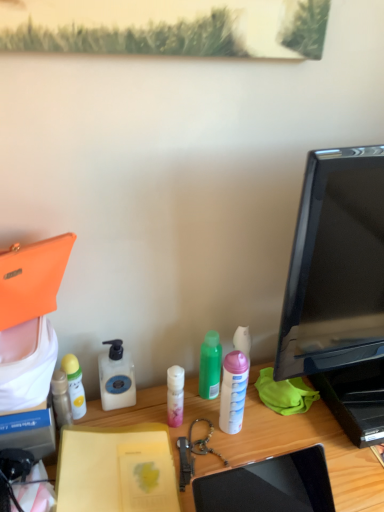
Question: Is yellow matte bottle at left, acting as the 4th bottle starting from the right, to the right of white matte spray can at center, the 1th bottle from the right, from the viewer's perspective?

Choices:
 (A) no
 (B) yes

Answer: (A)

Question: Is yellow matte bottle at left, arranged as the second bottle when viewed from the left, taller than white matte spray can at center, the 1th bottle from the right?

Choices:
 (A) yes
 (B) no

Answer: (B)

Question: Would you say white matte spray can at center, arranged as the 5th bottle when viewed from the left, is part of yellow matte bottle at left, arranged as the second bottle when viewed from the left,'s contents?

Choices:
 (A) yes
 (B) no

Answer: (B)

Question: From a real-world perspective, is yellow matte bottle at left, arranged as the second bottle when viewed from the left, physically above white matte spray can at center, the 1th bottle from the right?

Choices:
 (A) yes
 (B) no

Answer: (B)

Question: Is yellow matte bottle at left, arranged as the second bottle when viewed from the left, oriented away from white matte spray can at center, the 1th bottle from the right?

Choices:
 (A) no
 (B) yes

Answer: (A)

Question: Is yellow matte bottle at left, acting as the 4th bottle starting from the right, positioned far away from white matte spray can at center, the 1th bottle from the right?

Choices:
 (A) no
 (B) yes

Answer: (A)

Question: Considering the relative positions of white matte spray can at center, arranged as the 5th bottle when viewed from the left, and wooden desk at center in the image provided, is white matte spray can at center, arranged as the 5th bottle when viewed from the left, in front of wooden desk at center?

Choices:
 (A) no
 (B) yes

Answer: (A)

Question: Is white matte spray can at center, the 1th bottle from the right, next to wooden desk at center?

Choices:
 (A) yes
 (B) no

Answer: (B)

Question: From a real-world perspective, is white matte spray can at center, the 1th bottle from the right, on wooden desk at center?

Choices:
 (A) no
 (B) yes

Answer: (B)

Question: From the image's perspective, is white matte spray can at center, the 1th bottle from the right, on top of wooden desk at center?

Choices:
 (A) no
 (B) yes

Answer: (B)

Question: Is white matte spray can at center, the 1th bottle from the right, positioned behind wooden desk at center?

Choices:
 (A) no
 (B) yes

Answer: (B)

Question: Is white matte spray can at center, the 1th bottle from the right, to the left of wooden desk at center from the viewer's perspective?

Choices:
 (A) yes
 (B) no

Answer: (A)

Question: Is black glossy monitor at right wider than yellow matte notebook at center?

Choices:
 (A) yes
 (B) no

Answer: (B)